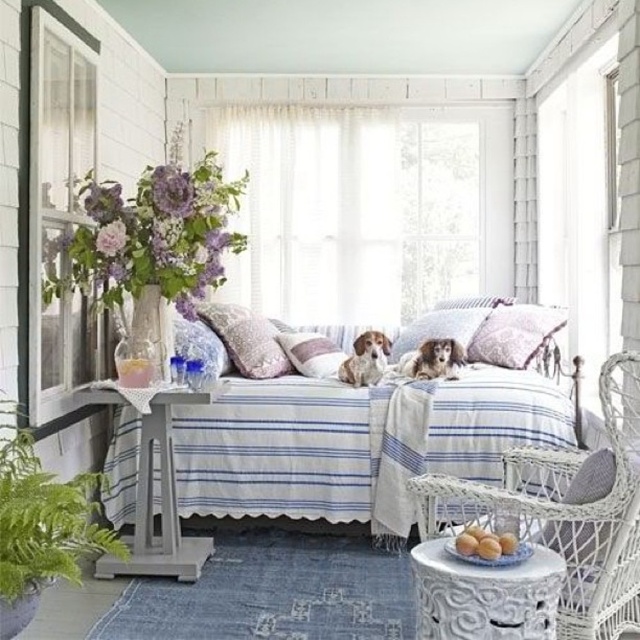
You are trying to decide where to place a new floor lamp in the sunroom. The lamp is 1.8 meters tall. Considering the white striped fabric bed at center and the white wicker chair at lower right, which object is shorter and would allow the lamp to stand safely without blocking the bed?

The white striped fabric bed at center is shorter than the white wicker chair at lower right. Since the lamp is 1.8 meters tall, placing it near the bed ensures it doesn not block the bed due to its lower height compared to the chair.

You are a photographer setting up a shot of the sunroom. You need to ensure that the pink textured pillow at center and the white fur dog at center are both in focus. Since the pillow is above the dog, how should you adjust your camera focus to capture both clearly?

To capture both the pink textured pillow at center and the white fur dog at center clearly, adjust the camera focus to a point between them, ensuring the depth of field includes both the pillow above and the dog below.

You are standing in the sunroom and want to place a small plant between the two points, point (504,442) and point (604,380). Which point should the plant be closer to if you want it to be nearer to the viewer?

The plant should be placed closer to point (504,442) because it is further to the viewer than point (604,380).